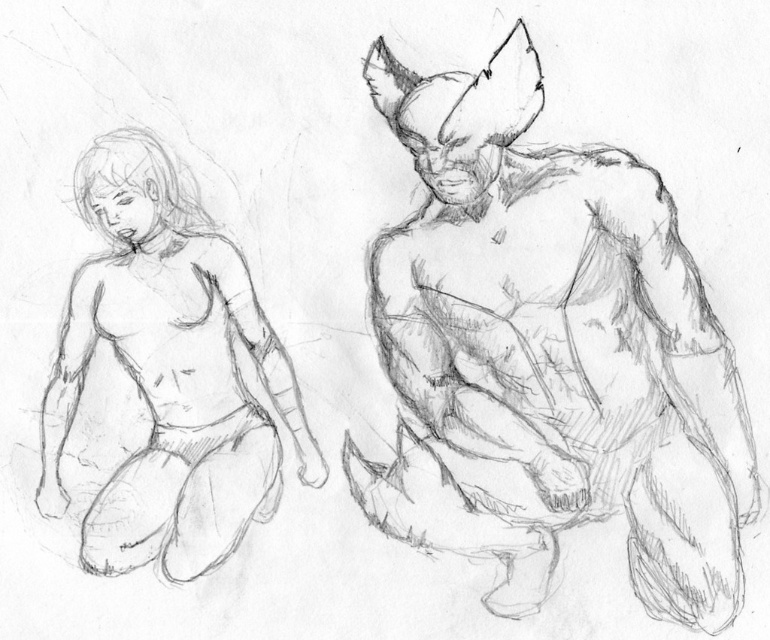
Based on the scene described, which figure is taller between the graphite sketch of muscular figure at right and the smooth skin figure at left?

The graphite sketch of muscular figure at right is taller than the smooth skin figure at left according to the description.

You are observing two points in a pencil sketch of two figures. The first point is at coordinates point (554, 502) and the second is at point (94, 492). Which of these points is nearer to the viewer?

Point (554, 502) is closer to the camera than point (94, 492).